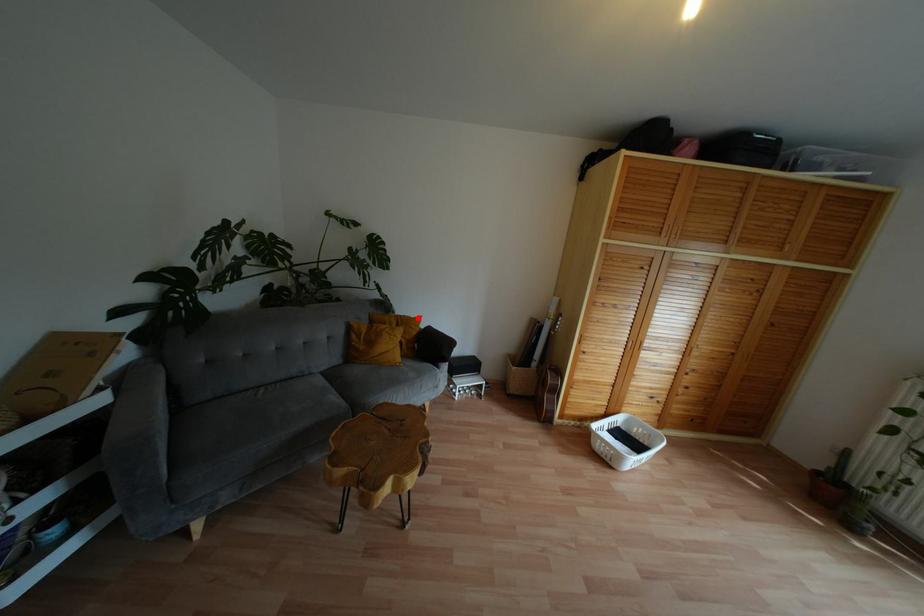
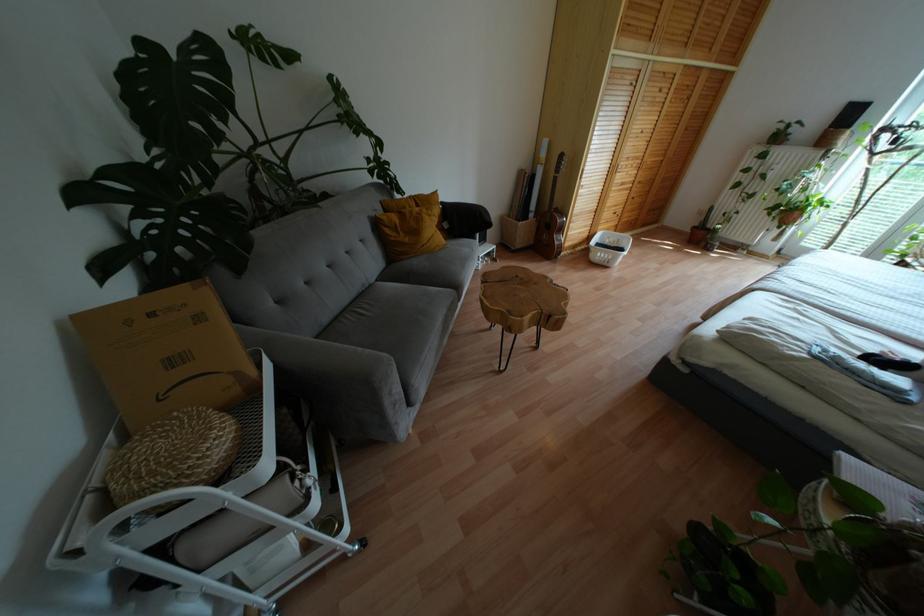
Locate, in the second image, the point that corresponds to the highlighted location in the first image.

(434, 193)